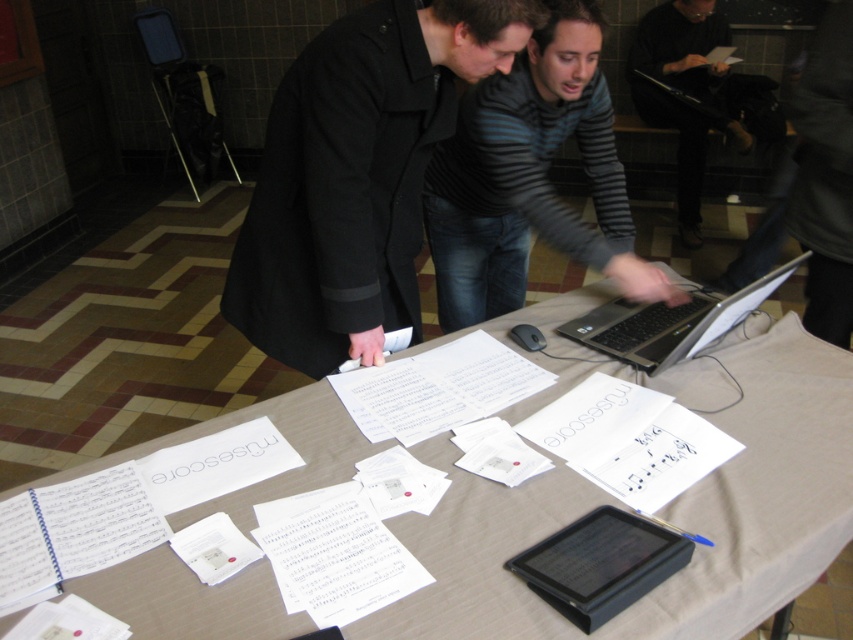
You are organizing a coat rack at an event venue. You have two items to hang up. The black matte coat at center and the dark gray sweater at upper right. Which item requires a larger hanger?

The dark gray sweater at upper right requires a larger hanger because the black matte coat at center has a smaller size compared to dark gray sweater at upper right.

You are organizing a photo shoot and need to ensure proper lighting for both the black matte coat at center and the dark gray sweater at upper right. Based on their positions in the image, which object is closer to the light source?

The dark gray sweater at upper right is closer to the light source because it is positioned above the black matte coat at center, which is placed underneath it.